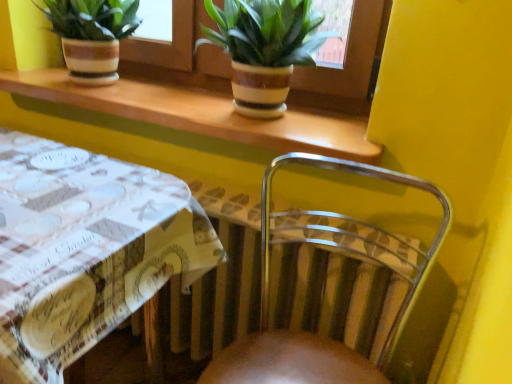
Question: Considering the positions of point (70, 71) and point (96, 254), is point (70, 71) closer or farther from the camera than point (96, 254)?

Choices:
 (A) farther
 (B) closer

Answer: (A)

Question: From their relative heights in the image, would you say matte striped pot at upper left, the 1th houseplant when ordered from left to right, is taller or shorter than white printed fabric at lower left?

Choices:
 (A) tall
 (B) short

Answer: (B)

Question: Which object is positioned closest to the green leafy plant in striped pot at upper center, acting as the second houseplant starting from the left?

Choices:
 (A) clear plastic chair at lower right
 (B) white printed fabric at lower left
 (C) matte striped pot at upper left, positioned as the second houseplant in right-to-left order
 (D) wooden at upper center
 (E) brown ceramic pots at upper center

Answer: (E)

Question: Considering the real-world distances, which object is farthest from the clear plastic chair at lower right?

Choices:
 (A) matte striped pot at upper left, positioned as the second houseplant in right-to-left order
 (B) wooden at upper center
 (C) brown ceramic pots at upper center
 (D) white printed fabric at lower left
 (E) green leafy plant in striped pot at upper center, the first houseplant positioned from the right

Answer: (A)